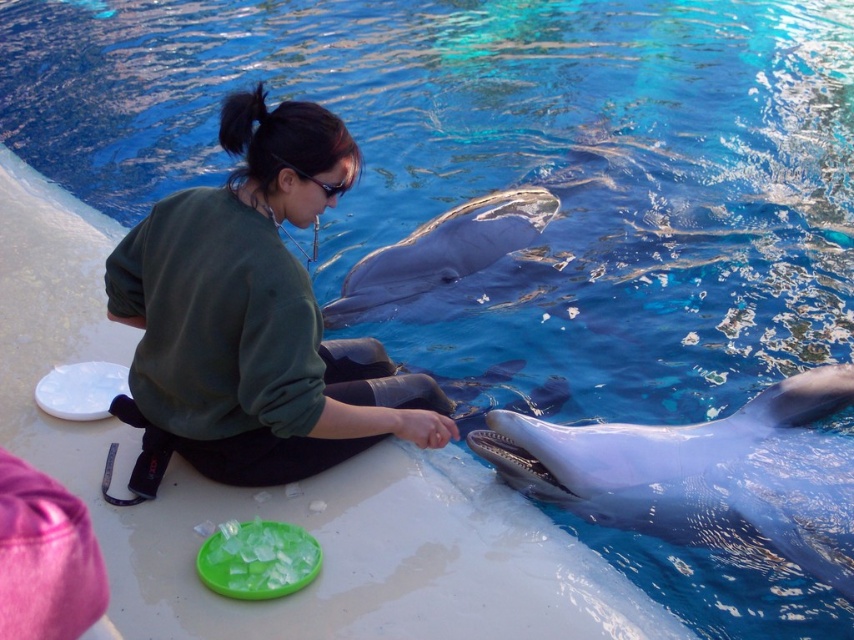
You are a photographer trying to capture a clear shot of the green matte sweatshirt at center and the smooth gray dolphin at lower right. Since you want both subjects to be in focus, you need to know which one is taller. Which object is taller?

The green matte sweatshirt at center is taller than the smooth gray dolphin at lower right according to the description.